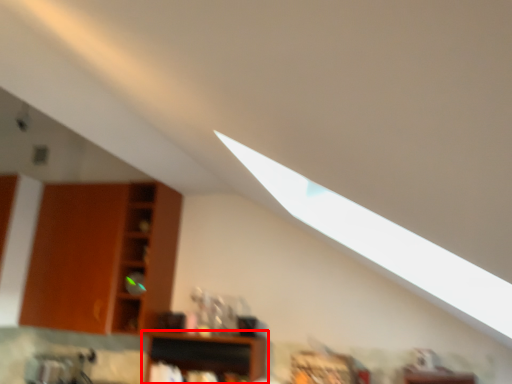
Question: From the image, what is the correct spatial relationship of shelf (annotated by the red box) in relation to shelf?

Choices:
 (A) right
 (B) left

Answer: (A)